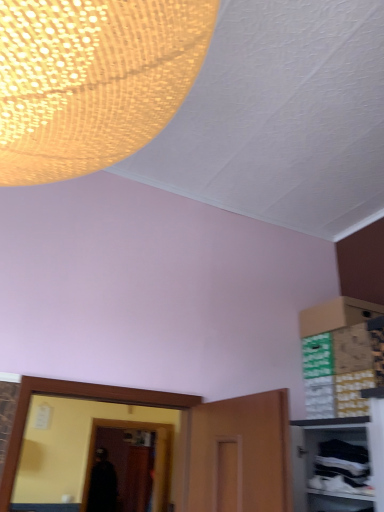
Question: Is the surface of transparent glass door at center in direct contact with white fabric cabinet at lower right?

Choices:
 (A) no
 (B) yes

Answer: (A)

Question: Does transparent glass door at center have a greater width compared to white fabric cabinet at lower right?

Choices:
 (A) no
 (B) yes

Answer: (A)

Question: Considering the relative sizes of transparent glass door at center and white fabric cabinet at lower right in the image provided, is transparent glass door at center shorter than white fabric cabinet at lower right?

Choices:
 (A) no
 (B) yes

Answer: (A)

Question: Can you confirm if transparent glass door at center is smaller than white fabric cabinet at lower right?

Choices:
 (A) yes
 (B) no

Answer: (B)

Question: Does transparent glass door at center contain white fabric cabinet at lower right?

Choices:
 (A) no
 (B) yes

Answer: (A)

Question: From a real-world perspective, is transparent glass door at center physically below white fabric cabinet at lower right?

Choices:
 (A) no
 (B) yes

Answer: (B)

Question: Does white fabric cabinet at lower right have a greater width compared to transparent glass door at center?

Choices:
 (A) no
 (B) yes

Answer: (B)

Question: From a real-world perspective, is white fabric cabinet at lower right under transparent glass door at center?

Choices:
 (A) yes
 (B) no

Answer: (B)

Question: Can you see white fabric cabinet at lower right touching transparent glass door at center?

Choices:
 (A) no
 (B) yes

Answer: (A)

Question: Is white fabric cabinet at lower right turned away from transparent glass door at center?

Choices:
 (A) no
 (B) yes

Answer: (A)

Question: Is the depth of white fabric cabinet at lower right greater than that of transparent glass door at center?

Choices:
 (A) no
 (B) yes

Answer: (A)

Question: Is white fabric cabinet at lower right smaller than transparent glass door at center?

Choices:
 (A) no
 (B) yes

Answer: (B)

Question: In terms of size, does white fabric cabinet at lower right appear bigger or smaller than transparent glass door at center?

Choices:
 (A) big
 (B) small

Answer: (B)